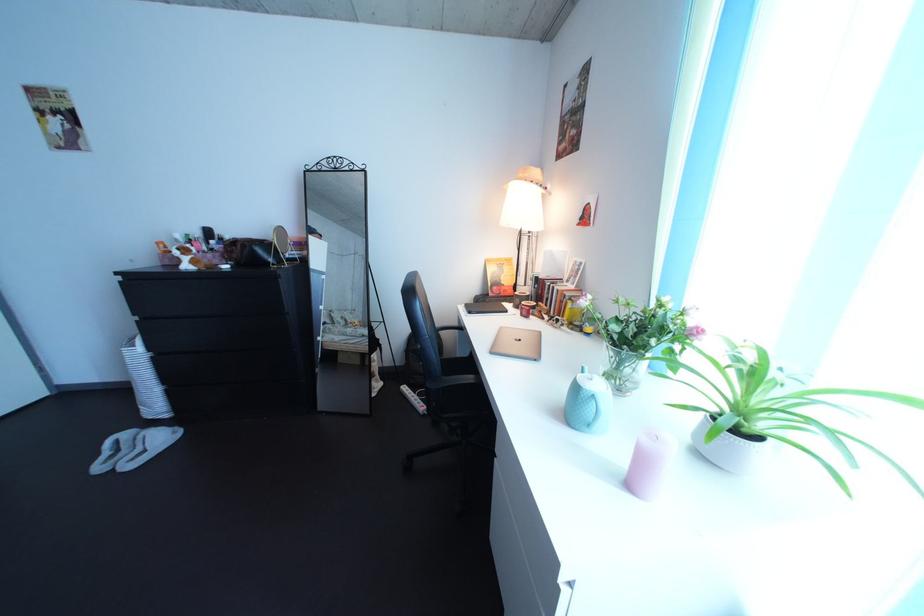
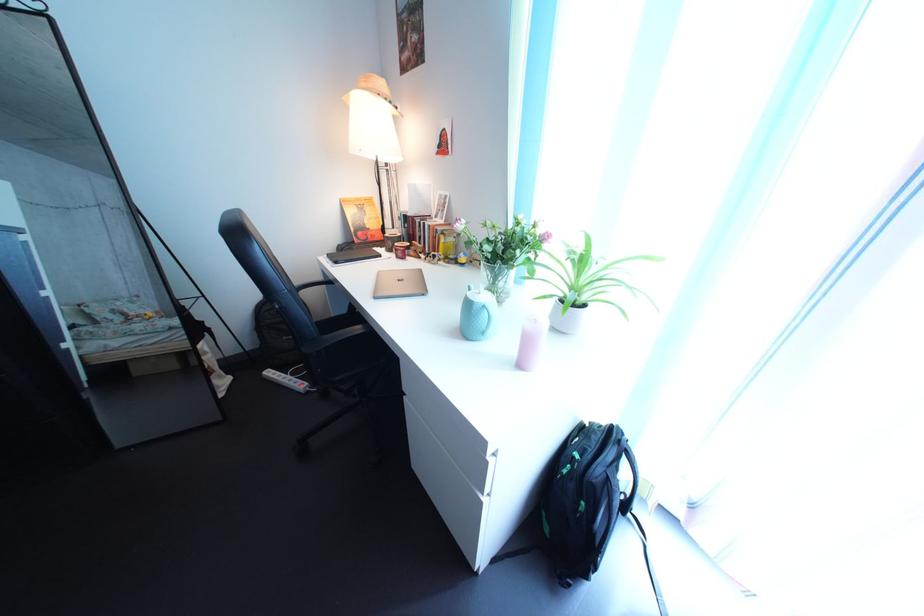
In the second image, find the point that corresponds to (699,416) in the first image.

(560, 305)